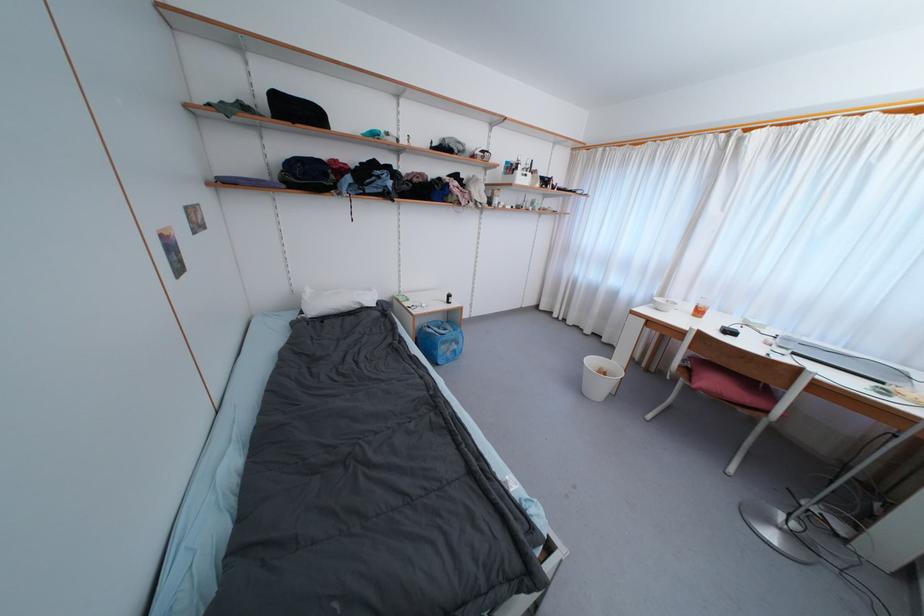
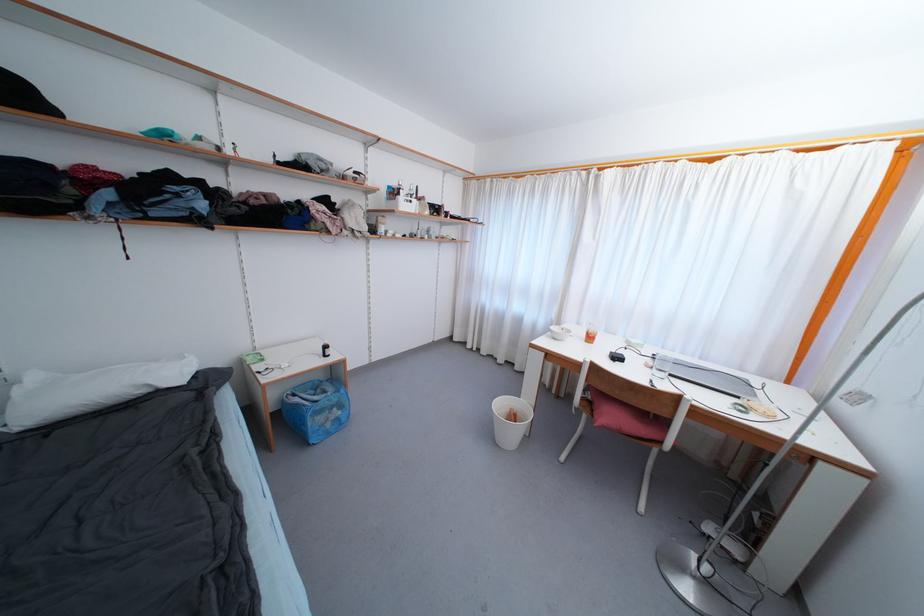
Find the pixel in the second image that matches pixel 432 330 in the first image.

(298, 398)